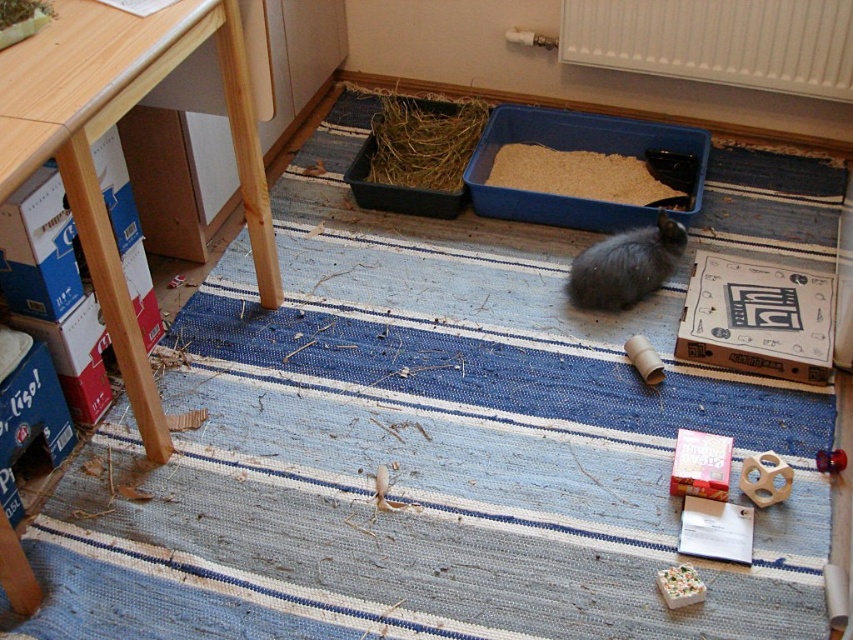
Question: Is white plastic radiator at upper center positioned at the back of brown cardboard box at center right?

Choices:
 (A) no
 (B) yes

Answer: (B)

Question: Does brown cardboard box at center right lie in front of brown straw at center?

Choices:
 (A) yes
 (B) no

Answer: (A)

Question: Which point appears closest to the camera in this image?

Choices:
 (A) (399, 112)
 (B) (548, 140)

Answer: (B)

Question: Which object appears farthest from the camera in this image?

Choices:
 (A) matte pink box at lower right
 (B) brown shredded hay at center
 (C) blue plastic litter box at center
 (D) blue cardboard box at left

Answer: (B)

Question: Does brown cardboard box at center right appear on the left side of blue plastic litter box at center?

Choices:
 (A) no
 (B) yes

Answer: (A)

Question: Which object appears farthest from the camera in this image?

Choices:
 (A) brown cardboard box at center right
 (B) brown straw at center
 (C) matte pink box at lower right

Answer: (B)